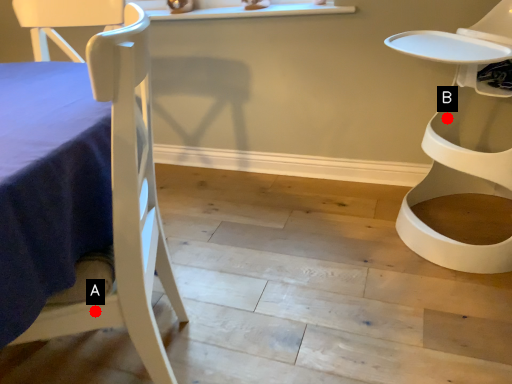
Question: Two points are circled on the image, labeled by A and B beside each circle. Among these points, which one is farthest from the camera?

Choices:
 (A) A is further
 (B) B is further

Answer: (B)